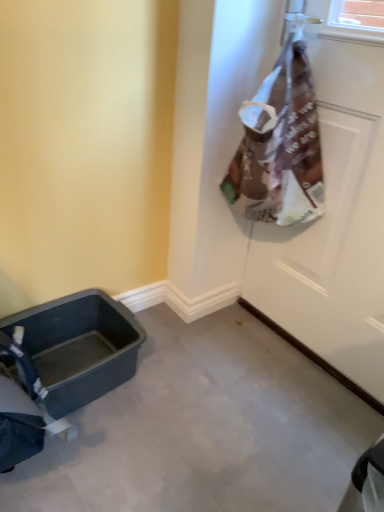
Question: From a real-world perspective, is matte plastic baby carriage at lower left above or below white matte door at upper right?

Choices:
 (A) below
 (B) above

Answer: (A)

Question: Is point (11, 318) closer or farther from the camera than point (319, 80)?

Choices:
 (A) closer
 (B) farther

Answer: (B)

Question: In terms of height, does matte plastic baby carriage at lower left look taller or shorter compared to white matte door at upper right?

Choices:
 (A) short
 (B) tall

Answer: (A)

Question: In terms of width, does white matte door at upper right look wider or thinner when compared to matte plastic baby carriage at lower left?

Choices:
 (A) wide
 (B) thin

Answer: (B)

Question: Considering their positions, is white matte door at upper right located in front of or behind matte plastic baby carriage at lower left?

Choices:
 (A) front
 (B) behind

Answer: (A)

Question: From a real-world perspective, is white matte door at upper right positioned above or below matte plastic baby carriage at lower left?

Choices:
 (A) above
 (B) below

Answer: (A)

Question: From the image's perspective, relative to matte plastic baby carriage at lower left, is white matte door at upper right above or below?

Choices:
 (A) above
 (B) below

Answer: (A)